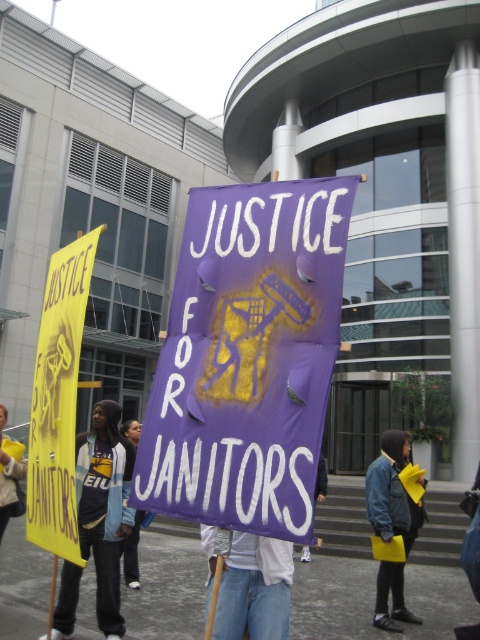
Question: Which point appears closest to the camera in this image?

Choices:
 (A) click(x=134, y=454)
 (B) click(x=386, y=486)
 (C) click(x=192, y=268)
 (D) click(x=14, y=497)

Answer: (C)

Question: Which of the following is the closest to the observer?

Choices:
 (A) (115, 540)
 (B) (412, 516)

Answer: (A)

Question: Does yellow fabric shirt at center appear on the left side of denim jacket at lower right?

Choices:
 (A) no
 (B) yes

Answer: (B)

Question: Is purple paper sign at center in front of denim jacket at lower right?

Choices:
 (A) yes
 (B) no

Answer: (A)

Question: Which object is positioned closest to the yellow paper sign at center?

Choices:
 (A) denim jacket at lower right
 (B) purple paper sign at center

Answer: (A)

Question: Does purple paper sign at center appear over yellow fabric shirt at center?

Choices:
 (A) no
 (B) yes

Answer: (B)